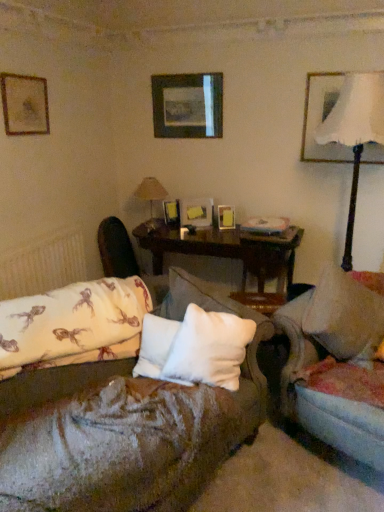
Question: Would you say wooden picture frame at center, marked as the fifth picture frame in a left-to-right arrangement, is a long distance from white fabric lampshade at upper right, the second table lamp when ordered from back to front?

Choices:
 (A) no
 (B) yes

Answer: (B)

Question: Can you confirm if wooden picture frame at center, marked as the fifth picture frame in a left-to-right arrangement, is positioned to the left of white fabric lampshade at upper right, placed as the 1th table lamp when sorted from right to left?

Choices:
 (A) no
 (B) yes

Answer: (B)

Question: Is wooden picture frame at center, the 2th picture frame viewed from the right, not within white fabric lampshade at upper right, the second table lamp when ordered from back to front?

Choices:
 (A) no
 (B) yes

Answer: (B)

Question: Considering the relative positions of wooden picture frame at center, the 2th picture frame viewed from the right, and white fabric lampshade at upper right, acting as the 2th table lamp starting from the left, in the image provided, is wooden picture frame at center, the 2th picture frame viewed from the right, behind white fabric lampshade at upper right, acting as the 2th table lamp starting from the left,?

Choices:
 (A) no
 (B) yes

Answer: (B)

Question: Does wooden picture frame at center, the 2th picture frame viewed from the right, have a greater width compared to white fabric lampshade at upper right, the second table lamp when ordered from back to front?

Choices:
 (A) yes
 (B) no

Answer: (B)

Question: Is wooden picture frame at center, the 2th picture frame viewed from the right, positioned before white fabric lampshade at upper right, placed as the 1th table lamp when sorted from right to left?

Choices:
 (A) no
 (B) yes

Answer: (A)

Question: Is velvet dark brown swivel chair at center far from matte white picture frame at upper right, which appears as the first picture frame when viewed from the right?

Choices:
 (A) yes
 (B) no

Answer: (A)

Question: From the image's perspective, is velvet dark brown swivel chair at center on top of matte white picture frame at upper right, which appears as the first picture frame when viewed from the right?

Choices:
 (A) yes
 (B) no

Answer: (B)

Question: Does velvet dark brown swivel chair at center appear on the right side of matte white picture frame at upper right, the 6th picture frame in the left-to-right sequence?

Choices:
 (A) yes
 (B) no

Answer: (B)

Question: Is the depth of velvet dark brown swivel chair at center less than that of matte white picture frame at upper right, which appears as the first picture frame when viewed from the right?

Choices:
 (A) no
 (B) yes

Answer: (A)

Question: Does velvet dark brown swivel chair at center have a smaller size compared to matte white picture frame at upper right, the 6th picture frame in the left-to-right sequence?

Choices:
 (A) no
 (B) yes

Answer: (A)

Question: Is velvet dark brown swivel chair at center oriented towards matte white picture frame at upper right, which appears as the first picture frame when viewed from the right?

Choices:
 (A) no
 (B) yes

Answer: (B)

Question: Is wooden picture frame at center, which is counted as the fourth picture frame, starting from the right, located within velvet beige couch at center?

Choices:
 (A) no
 (B) yes

Answer: (A)